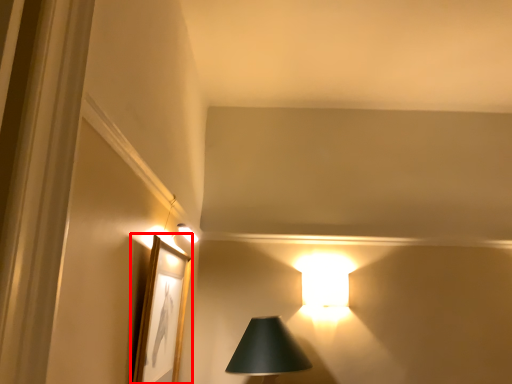
Question: From the image's perspective, considering the relative positions of picture frame (annotated by the red box) and lamp in the image provided, where is picture frame (annotated by the red box) located with respect to the staircase?

Choices:
 (A) above
 (B) below

Answer: (A)